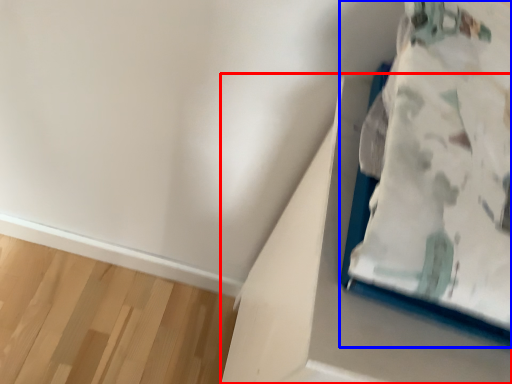
Question: Among these objects, which one is nearest to the camera, cardboard box (highlighted by a red box) or furniture (highlighted by a blue box)?

Choices:
 (A) cardboard box
 (B) furniture

Answer: (B)